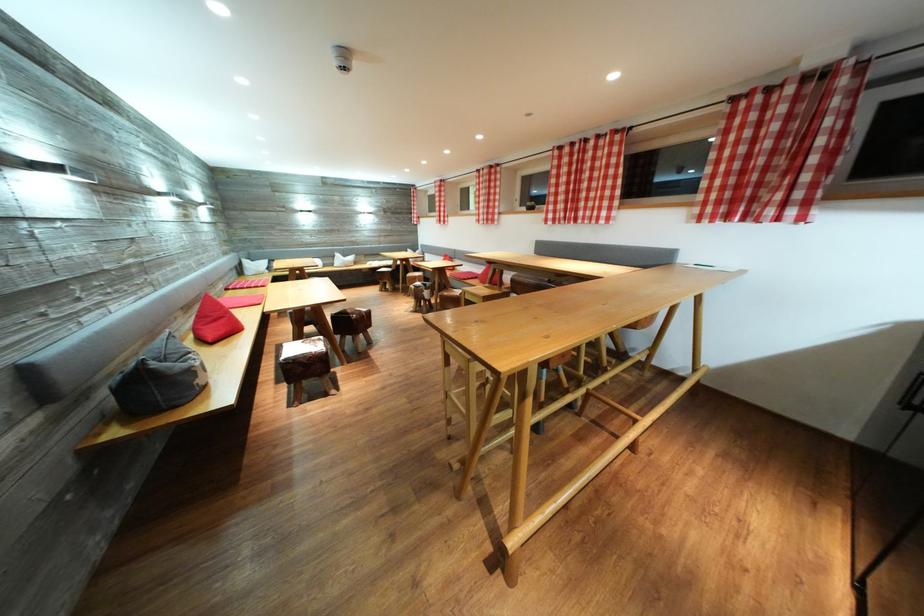
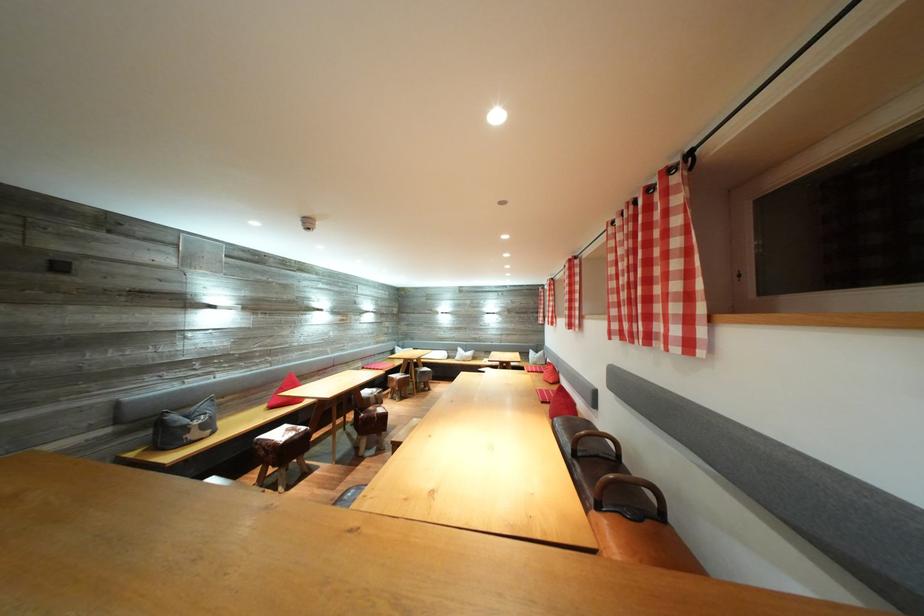
Where in the second image is the point corresponding to point 494,219 from the first image?

(578, 322)